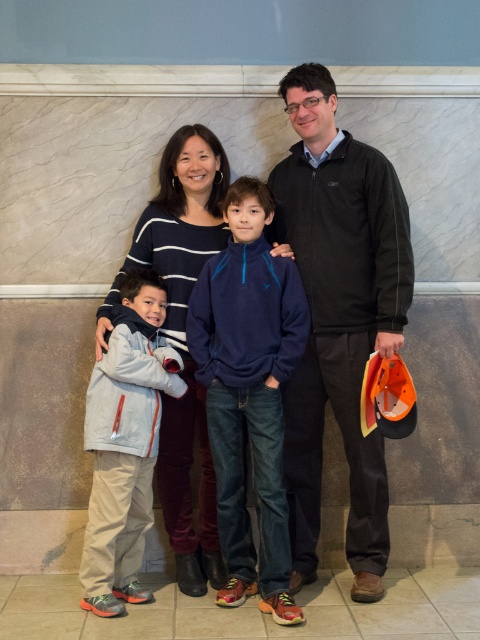
Question: Which point is closer to the camera?

Choices:
 (A) light gray fleece jacket at left
 (B) matte blue sweatshirt at center
 (C) striped sweater at center
 (D) navy fleece jacket at center

Answer: (D)

Question: Is dark gray fleece sweater at center above striped sweater at center?

Choices:
 (A) yes
 (B) no

Answer: (A)

Question: Which of these objects is positioned closest to the navy fleece jacket at center?

Choices:
 (A) matte blue sweatshirt at center
 (B) light gray fleece jacket at left
 (C) dark gray fleece sweater at center
 (D) striped sweater at center

Answer: (A)

Question: Is dark gray fleece sweater at center positioned before navy fleece jacket at center?

Choices:
 (A) no
 (B) yes

Answer: (A)

Question: Based on their relative distances, which object is nearer to the matte blue sweatshirt at center?

Choices:
 (A) navy fleece jacket at center
 (B) striped sweater at center
 (C) light gray fleece jacket at left

Answer: (A)

Question: Can you confirm if dark gray fleece sweater at center is wider than striped sweater at center?

Choices:
 (A) no
 (B) yes

Answer: (B)